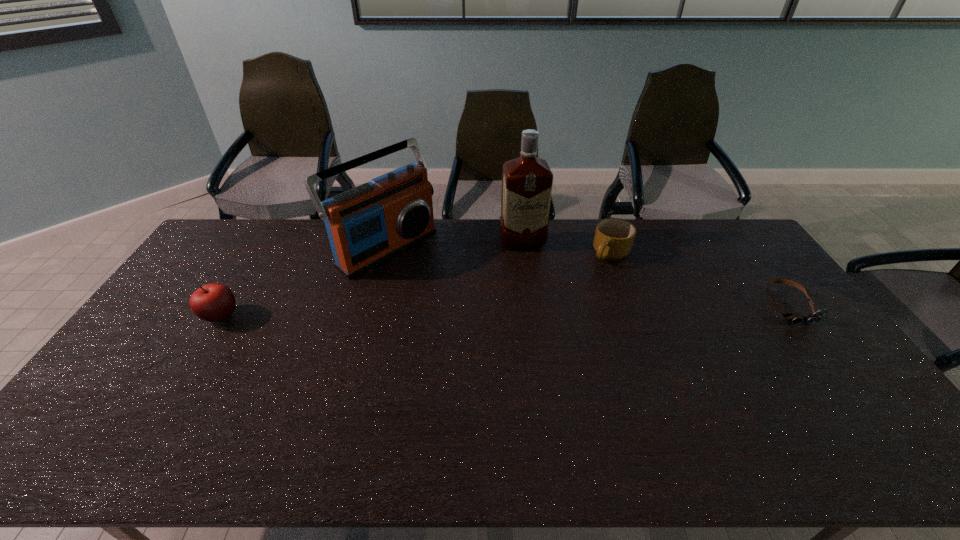
The image size is (960, 540). What are the coordinates of `vacant space located 0.190m on the front-facing side of the shortest object` in the screenshot? It's located at (842, 377).

Locate an element on the screen. The height and width of the screenshot is (540, 960). vacant space located on the front-facing side of the second object from left to right is located at coordinates [x=441, y=288].

Where is `free region located on the front-facing side of the second object from left to right`? Image resolution: width=960 pixels, height=540 pixels. free region located on the front-facing side of the second object from left to right is located at coordinates (447, 293).

This screenshot has width=960, height=540. Find the location of `vacant space located on the front-facing side of the second object from left to right`. vacant space located on the front-facing side of the second object from left to right is located at coordinates [x=435, y=284].

You are a GUI agent. You are given a task and a screenshot of the screen. Output one action in this format:
    pyautogui.click(x=<x>, y=<y>)
    Task: Click on the vacant space located on the side with the handle of the fourth tallest object
    
    Given the screenshot: What is the action you would take?
    pyautogui.click(x=572, y=281)

Find the location of a particular element. Image resolution: width=960 pixels, height=540 pixels. blank space located 0.050m on the side with the handle of the fourth tallest object is located at coordinates pos(589,270).

This screenshot has height=540, width=960. Identify the location of vacant space located on the side with the handle of the fourth tallest object. (572, 281).

You are a GUI agent. You are given a task and a screenshot of the screen. Output one action in this format:
    pyautogui.click(x=<x>, y=<y>)
    Task: Click on the free space located on the front label of the third object from left to right
    
    Given the screenshot: What is the action you would take?
    pyautogui.click(x=532, y=272)

You are a GUI agent. You are given a task and a screenshot of the screen. Output one action in this format:
    pyautogui.click(x=<x>, y=<y>)
    Task: Click on the free space located 0.080m on the front label of the third object from left to right
    The image size is (960, 540).
    Given the screenshot: What is the action you would take?
    pyautogui.click(x=531, y=266)

You are a GUI agent. You are given a task and a screenshot of the screen. Output one action in this format:
    pyautogui.click(x=<x>, y=<y>)
    Task: Click on the vacant space situated 0.250m on the front label of the third object from left to right
    The height and width of the screenshot is (540, 960).
    Given the screenshot: What is the action you would take?
    pyautogui.click(x=541, y=300)